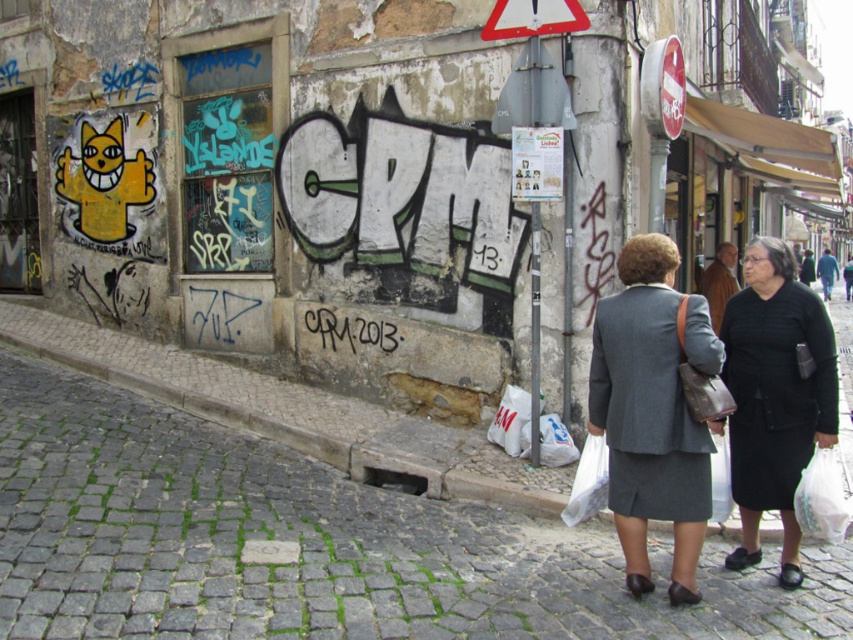
Consider the image. You are standing in front of the weathered stone wall with graffiti. There are two points marked on the wall. One is at coordinate point [650,492] and the other at point [575,22]. Which point is closer to you?

Point [650,492] is closer to the camera than point [575,22].

You are a photographer standing on the cobblestone pavement at lower left and want to take a photo of the gray wool suit at center. Which object should you move closer to in order to get a better shot?

The gray wool suit at center is behind the cobblestone pavement at lower left, so you should move closer to the gray wool suit at center to get a better shot.

You are a delivery person who needs to place a 2.5 meter long package between the cobblestone pavement at lower left and the metallic triangular sign at upper center. Is there enough space to fit the package horizontally between these two objects?

The distance between the cobblestone pavement at lower left and the metallic triangular sign at upper center is 3.31 meters. Since the package is 2.5 meters long, there is sufficient space to fit it horizontally between them.